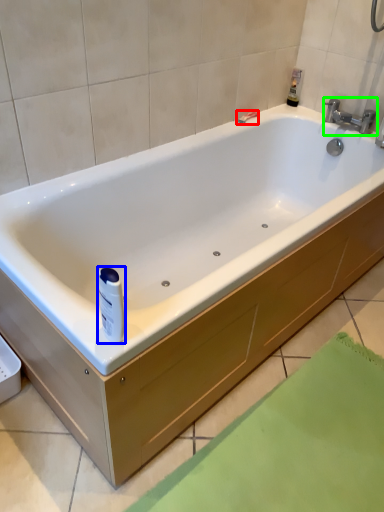
Question: Estimate the real-world distances between objects in this image. Which object is closer to shower (highlighted by a red box), toiletry (highlighted by a blue box) or tap (highlighted by a green box)?

Choices:
 (A) toiletry
 (B) tap

Answer: (B)